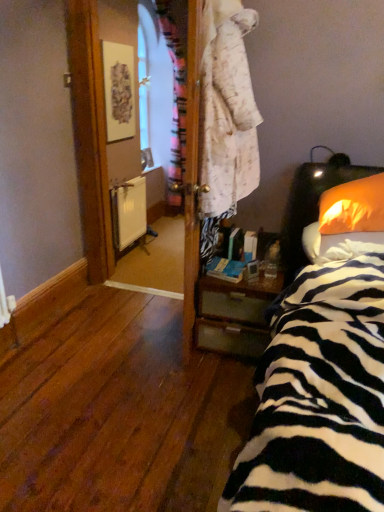
Find the location of `free location above wooden nightstand at lower right (from a real-world perspective)`. free location above wooden nightstand at lower right (from a real-world perspective) is located at coordinates (257, 274).